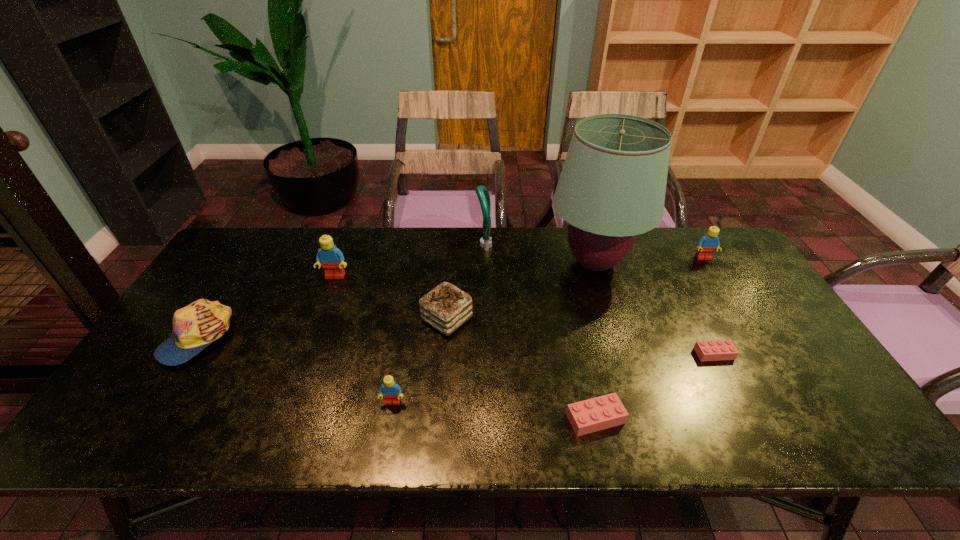
This screenshot has width=960, height=540. I want to click on free location that satisfies the following two spatial constraints: 1. at the jaws of the green bottle opener; 2. on the right side of the third nearest Lego, so click(485, 354).

Where is `free location that satisfies the following two spatial constraints: 1. on the front side of the shortest Lego; 2. on the right side of the lampshade`? free location that satisfies the following two spatial constraints: 1. on the front side of the shortest Lego; 2. on the right side of the lampshade is located at coordinates (623, 354).

The image size is (960, 540). I want to click on free spot that satisfies the following two spatial constraints: 1. at the jaws of the eighth shortest object; 2. on the bill of the cap, so click(485, 336).